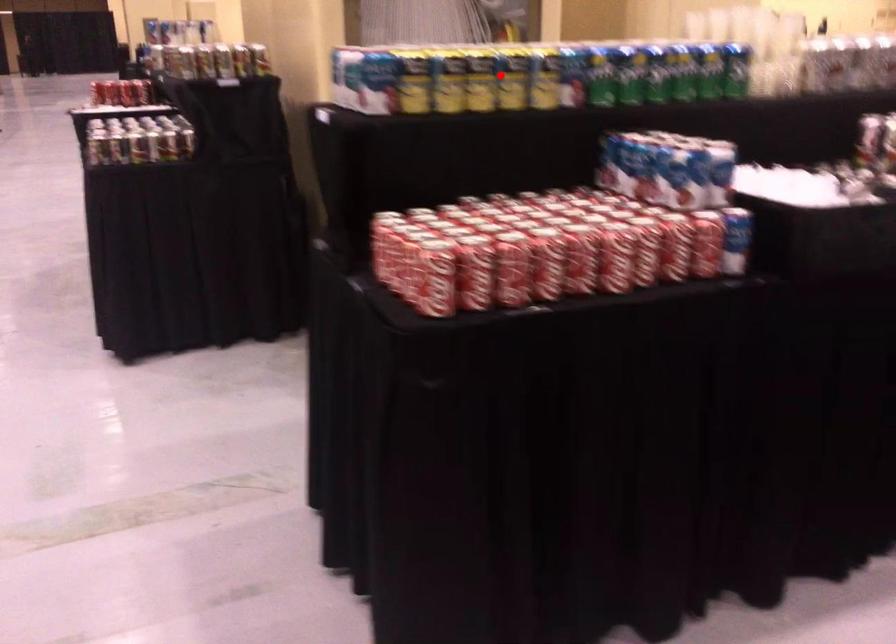
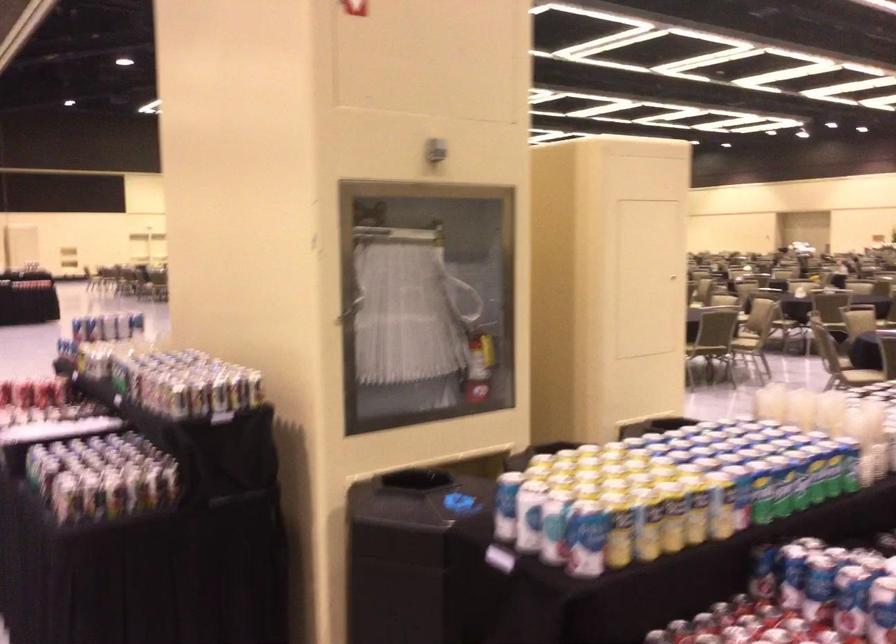
Question: I am providing you with two images of the same scene from different viewpoints. A red point is marked on the first image. Is the red point's position out of view in image 2?

Choices:
 (A) Yes
 (B) No

Answer: (B)